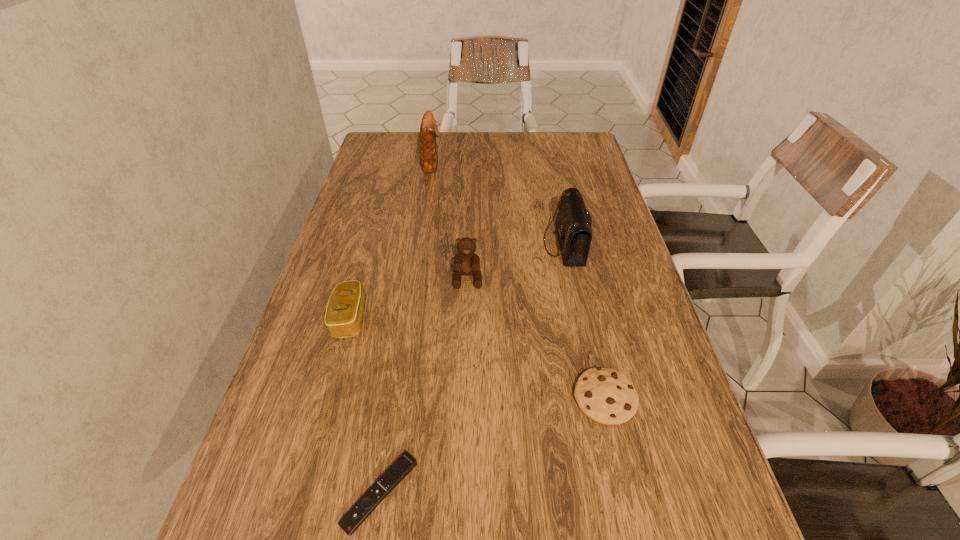
Where is `object identified as the second closest to the farthest object`? object identified as the second closest to the farthest object is located at coordinates (466, 262).

Locate which clutch bag is the second closest to the fourth object from left to right. Please provide its 2D coordinates. Your answer should be formatted as a tuple, i.e. [(x, y)], where the tuple contains the x and y coordinates of a point satisfying the conditions above.

[(344, 314)]

This screenshot has width=960, height=540. Find the location of `clutch bag object that ranks as the second closest to the fourth object from left to right`. clutch bag object that ranks as the second closest to the fourth object from left to right is located at coordinates (344, 314).

Find the location of a particular element. This screenshot has width=960, height=540. free space that satisfies the following two spatial constraints: 1. on the zipper side of the shortest clutch bag; 2. on the left side of the second nearest object is located at coordinates (328, 398).

Where is `free space that satisfies the following two spatial constraints: 1. on the zipper side of the fifth tallest object; 2. on the right side of the nearest clutch bag`? free space that satisfies the following two spatial constraints: 1. on the zipper side of the fifth tallest object; 2. on the right side of the nearest clutch bag is located at coordinates (328, 398).

Find the location of a particular element. Image resolution: width=960 pixels, height=540 pixels. free spot that satisfies the following two spatial constraints: 1. on the front flap of the second farthest object; 2. on the front side of the nearest object is located at coordinates (618, 493).

You are a GUI agent. You are given a task and a screenshot of the screen. Output one action in this format:
    pyautogui.click(x=<x>, y=<y>)
    Task: Click on the blank area in the image that satisfies the following two spatial constraints: 1. on the open side of the farthest object; 2. on the front side of the shortest object
    
    Given the screenshot: What is the action you would take?
    pyautogui.click(x=381, y=493)

Identify the location of free region that satisfies the following two spatial constraints: 1. on the face of the teddy bear; 2. on the zipper side of the fourth farthest object. tap(467, 318).

In order to click on vacant region that satisfies the following two spatial constraints: 1. on the face of the third object from right to left; 2. on the right side of the cookie in this screenshot , I will do `click(464, 398)`.

I want to click on vacant position in the image that satisfies the following two spatial constraints: 1. on the open side of the farthest object; 2. on the front side of the remote control, so click(x=381, y=493).